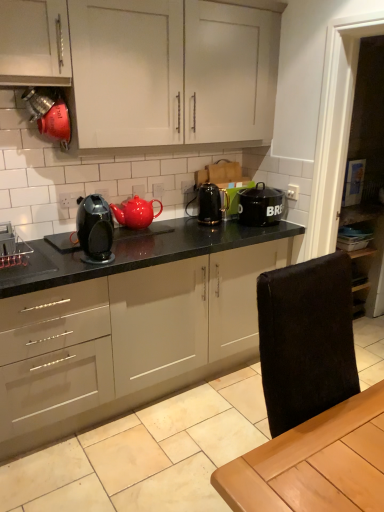
In order to click on free spot to the left of black glossy electric kettle at center, arranged as the first appliance when viewed from the top in this screenshot , I will do `click(182, 227)`.